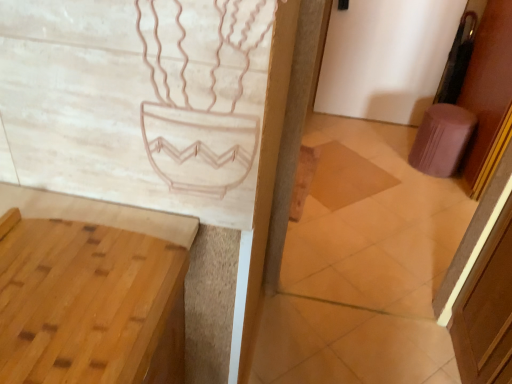
Question: Does brown wood screen door at right have a lesser height compared to pink fabric stool at right?

Choices:
 (A) no
 (B) yes

Answer: (A)

Question: Does brown wood screen door at right have a larger size compared to pink fabric stool at right?

Choices:
 (A) yes
 (B) no

Answer: (A)

Question: Is brown wood screen door at right located outside pink fabric stool at right?

Choices:
 (A) yes
 (B) no

Answer: (A)

Question: Considering the relative sizes of brown wood screen door at right and pink fabric stool at right in the image provided, is brown wood screen door at right thinner than pink fabric stool at right?

Choices:
 (A) yes
 (B) no

Answer: (A)

Question: Is brown wood screen door at right directly adjacent to pink fabric stool at right?

Choices:
 (A) yes
 (B) no

Answer: (B)

Question: Considering the positions of light brown wood vanity at lower left and brown wood screen door at right in the image, is light brown wood vanity at lower left wider or thinner than brown wood screen door at right?

Choices:
 (A) thin
 (B) wide

Answer: (B)

Question: Based on their sizes in the image, would you say light brown wood vanity at lower left is bigger or smaller than brown wood screen door at right?

Choices:
 (A) big
 (B) small

Answer: (B)

Question: Considering the positions of light brown wood vanity at lower left and brown wood screen door at right in the image, is light brown wood vanity at lower left taller or shorter than brown wood screen door at right?

Choices:
 (A) short
 (B) tall

Answer: (A)

Question: Considering the positions of point (33, 355) and point (473, 284), is point (33, 355) closer or farther from the camera than point (473, 284)?

Choices:
 (A) farther
 (B) closer

Answer: (B)

Question: Is brown wood screen door at right situated inside pink fabric stool at right or outside?

Choices:
 (A) outside
 (B) inside

Answer: (A)

Question: Considering the positions of point (477, 274) and point (435, 168), is point (477, 274) closer or farther from the camera than point (435, 168)?

Choices:
 (A) closer
 (B) farther

Answer: (A)

Question: Is brown wood screen door at right taller or shorter than pink fabric stool at right?

Choices:
 (A) short
 (B) tall

Answer: (B)

Question: From the image's perspective, is brown wood screen door at right positioned above or below pink fabric stool at right?

Choices:
 (A) above
 (B) below

Answer: (B)

Question: From the image's perspective, relative to brown wooden tile at center, is light brown wood vanity at lower left above or below?

Choices:
 (A) below
 (B) above

Answer: (A)

Question: Which is correct: light brown wood vanity at lower left is inside brown wooden tile at center, or outside of it?

Choices:
 (A) outside
 (B) inside

Answer: (A)